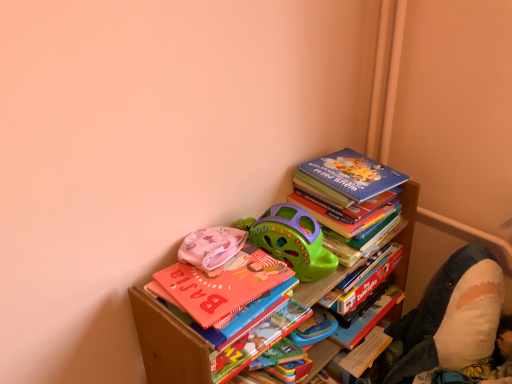
This screenshot has height=384, width=512. Identify the location of vacant space to the right of pink fabric at upper left, which is the third toy in right-to-left order. (268, 256).